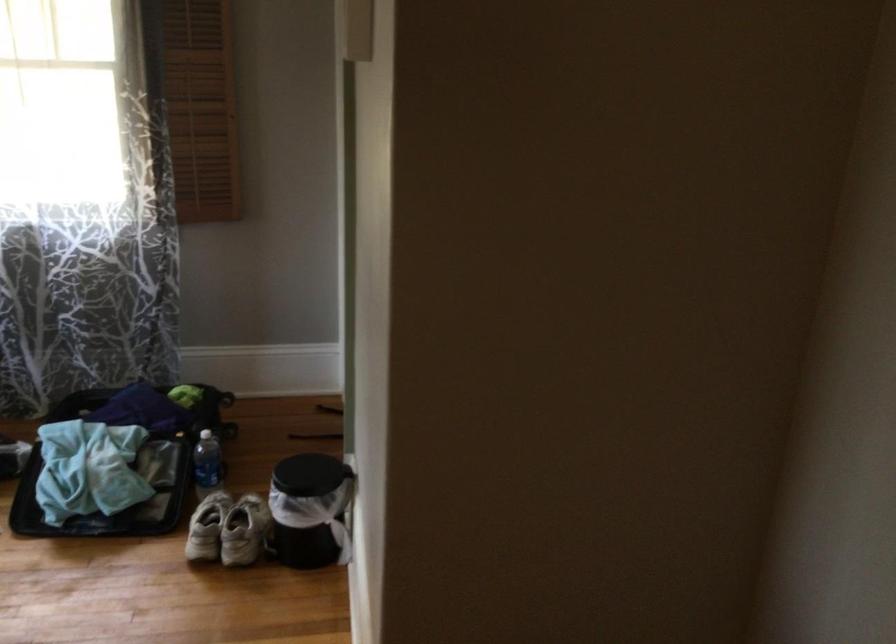
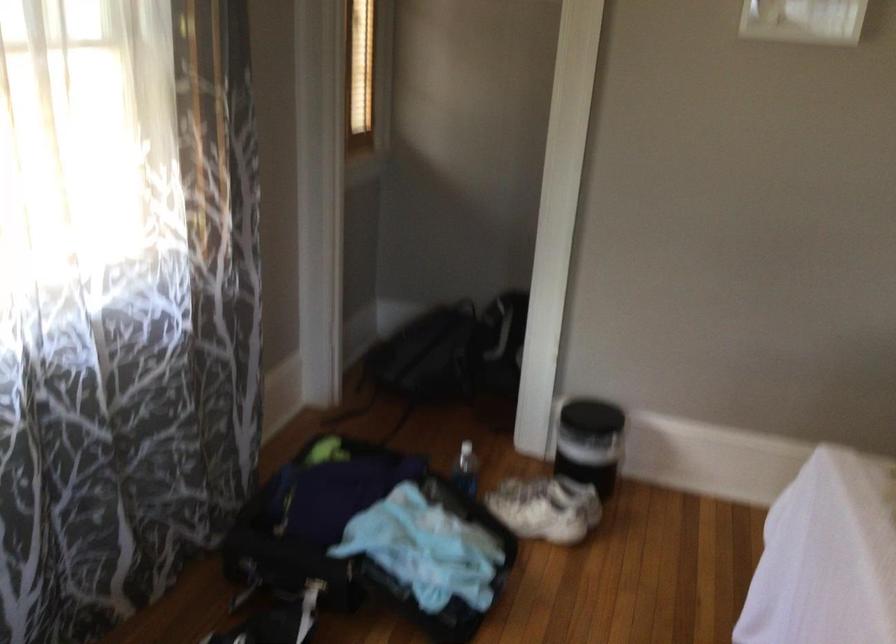
Find the pixel in the second image that matches [204,520] in the first image.

(546, 507)